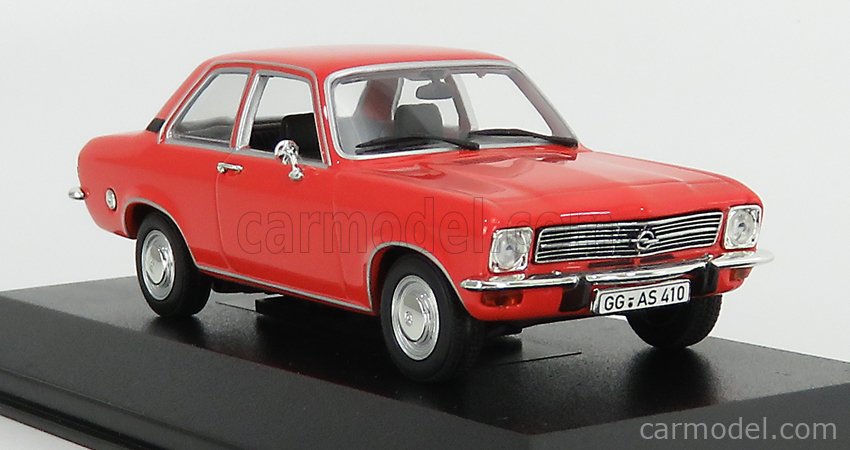
Where is `mirrors`? The width and height of the screenshot is (850, 450). mirrors is located at coordinates (286, 148), (439, 89).